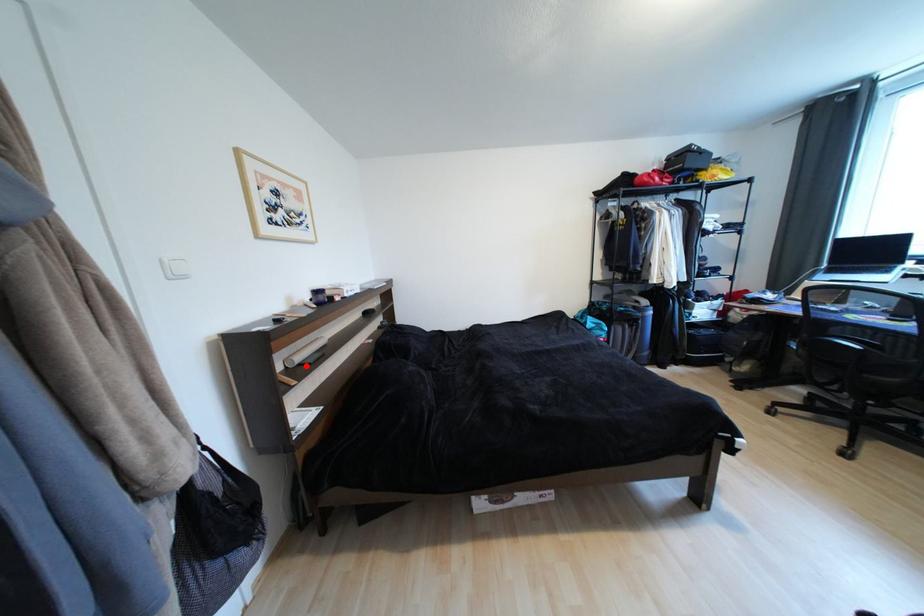
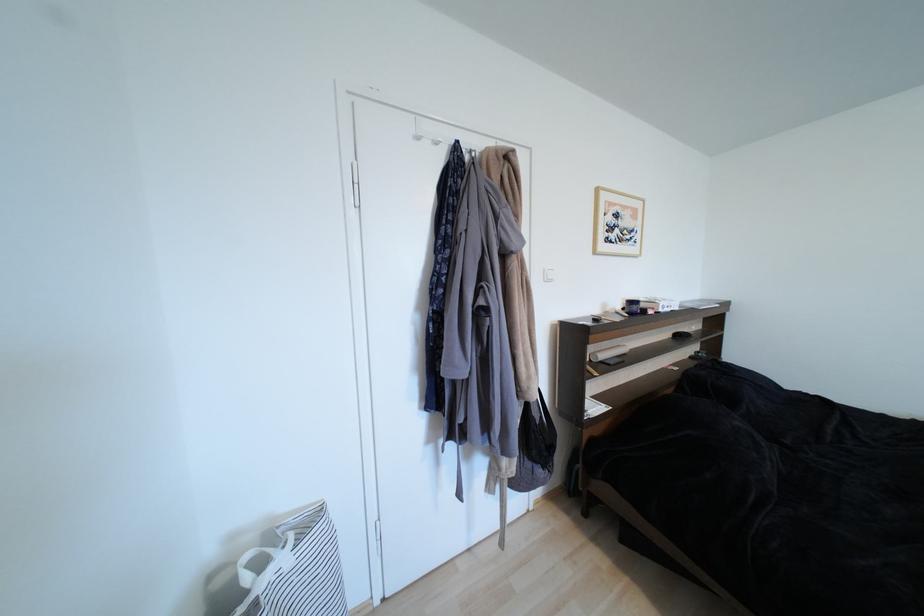
Question: A red point is marked in image1. In image2, is the corresponding 3D point closer to the camera or farther? Reply with the corresponding letter.

Choices:
 (A) The corresponding 3D point is closer.
 (B) The corresponding 3D point is farther.

Answer: (B)